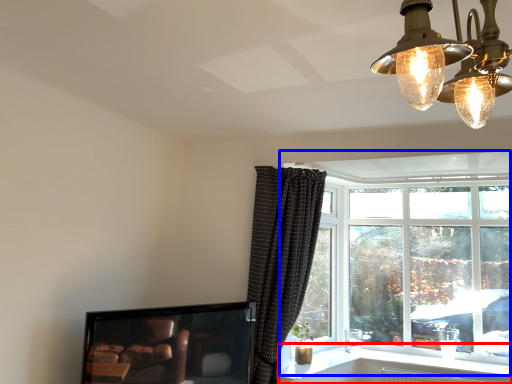
Question: Among these objects, which one is nearest to the camera, window sill (highlighted by a red box) or window (highlighted by a blue box)?

Choices:
 (A) window sill
 (B) window

Answer: (A)